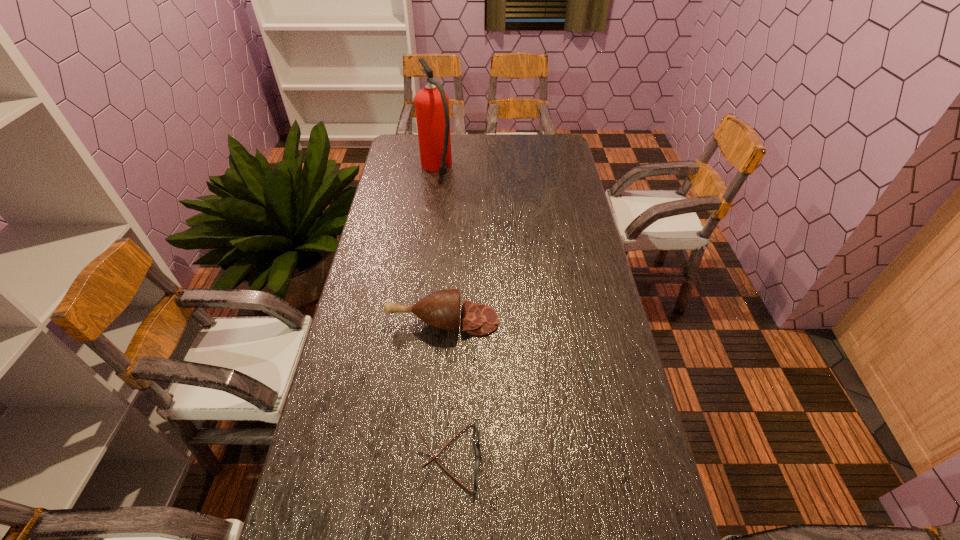
Find the location of a particular element. The image size is (960, 540). free space located 0.400m on the front-facing side of the spectacles is located at coordinates (648, 456).

Where is `object at the far edge`? object at the far edge is located at coordinates (431, 103).

Find the location of a particular element. fire extinguisher present at the left edge is located at coordinates (431, 103).

Locate an element on the screen. ham that is at the left edge is located at coordinates (441, 309).

Locate an element on the screen. The height and width of the screenshot is (540, 960). object located at the far left corner is located at coordinates (431, 103).

Where is `vacant space at the far edge of the desktop`? vacant space at the far edge of the desktop is located at coordinates (509, 154).

Where is `free space at the left edge`? free space at the left edge is located at coordinates (383, 198).

In the image, there is a desktop. Where is `vacant area at the right edge`? Image resolution: width=960 pixels, height=540 pixels. vacant area at the right edge is located at coordinates (575, 290).

I want to click on vacant area that lies between the tallest object and the ham, so [440, 244].

Identify the location of vacant space that is in between the nearest object and the second nearest object. The width and height of the screenshot is (960, 540). (447, 389).